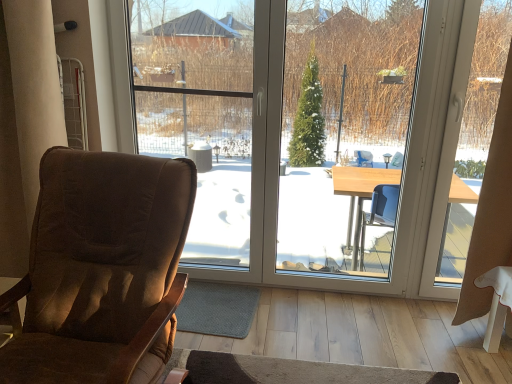
Question: Is point (229, 173) positioned closer to the camera than point (471, 289)?

Choices:
 (A) farther
 (B) closer

Answer: (A)

Question: Based on their sizes in the image, would you say transparent glass window screen at center is bigger or smaller than beige fabric curtain at right?

Choices:
 (A) small
 (B) big

Answer: (B)

Question: Estimate the real-world distances between objects in this image. Which object is farther from the transparent glass window at center?

Choices:
 (A) transparent glass window screen at center
 (B) brown fabric chair at left
 (C) beige fabric curtain at right

Answer: (B)

Question: Which object is the closest to the brown fabric chair at left?

Choices:
 (A) transparent glass window screen at center
 (B) transparent glass window at center
 (C) beige fabric curtain at right

Answer: (B)